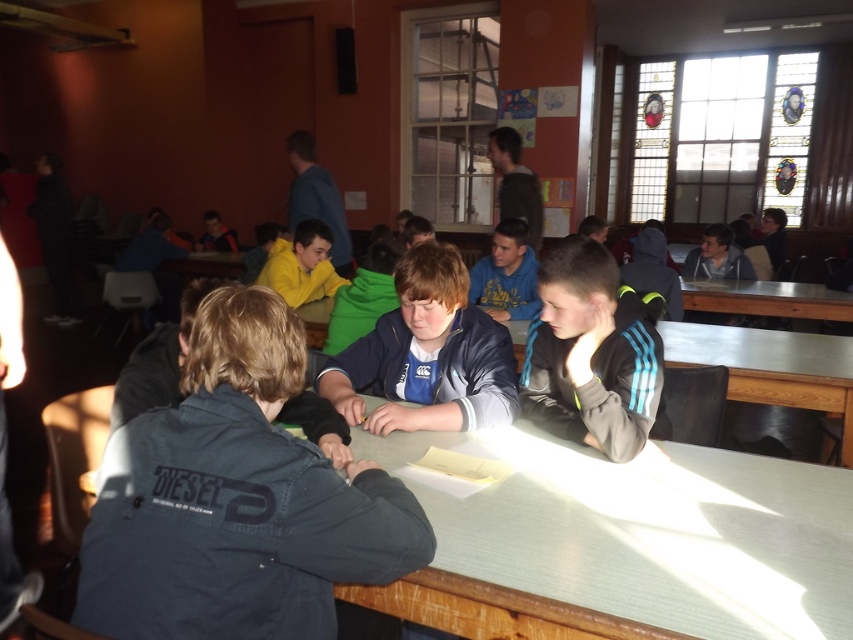
You are organizing a clothing donation drive and need to categorize items by size. You have two jackets in front of you, the yellow fleece jacket at center and the dark gray hoodie at center. Which jacket should you place in the large size bin?

The yellow fleece jacket at center should be placed in the large size bin because it has a larger size compared to the dark gray hoodie at center.

Based on the photo, you are standing at the entrance of the dining area and want to locate the black matte jacket at center. According to the coordinates provided, where should you look relative to the entrance?

The black matte jacket at center is located at coordinates point (590, 355), which would be approximately in the center of the image. Since you are facing the entrance, the jacket is directly ahead of you, slightly to the right and lower portion of the scene.

You are a tailor observing two jackets in a communal dining area. The jackets are the black matte jacket at center and the blue fleece jacket at center. Which jacket is shorter in height?

The black matte jacket at center is not as tall as the blue fleece jacket at center, so the black matte jacket at center is shorter in height.